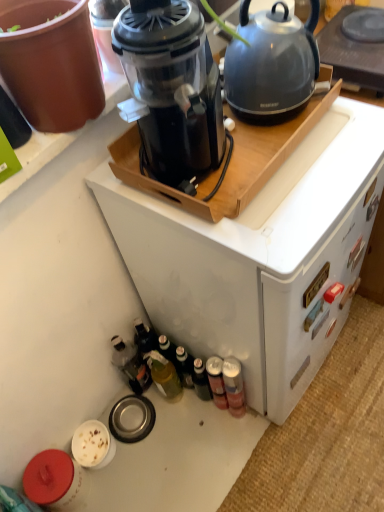
Question: Is metallic silver can at lower right, which is the 4th bottle from left to right, bigger than black plastic blender at upper center?

Choices:
 (A) no
 (B) yes

Answer: (A)

Question: Considering the relative sizes of metallic silver can at lower right, which is the 4th bottle from left to right, and black plastic blender at upper center in the image provided, is metallic silver can at lower right, which is the 4th bottle from left to right, thinner than black plastic blender at upper center?

Choices:
 (A) no
 (B) yes

Answer: (B)

Question: Is metallic silver can at lower right, the first bottle positioned from the right, outside black plastic blender at upper center?

Choices:
 (A) no
 (B) yes

Answer: (B)

Question: Can you confirm if metallic silver can at lower right, which is the 4th bottle from left to right, is taller than black plastic blender at upper center?

Choices:
 (A) no
 (B) yes

Answer: (A)

Question: Can you confirm if metallic silver can at lower right, the first bottle positioned from the right, is smaller than black plastic blender at upper center?

Choices:
 (A) no
 (B) yes

Answer: (B)

Question: Is the depth of metallic silver can at lower right, which is the 4th bottle from left to right, greater than that of black plastic blender at upper center?

Choices:
 (A) no
 (B) yes

Answer: (B)

Question: Is metallic silver can at lower right, which is the third bottle from left to right, bigger than metallic silver can at lower right, the first bottle positioned from the right?

Choices:
 (A) no
 (B) yes

Answer: (A)

Question: Is metallic silver can at lower right, which is the third bottle from left to right, to the right of metallic silver can at lower right, the first bottle positioned from the right, from the viewer's perspective?

Choices:
 (A) no
 (B) yes

Answer: (A)

Question: Does metallic silver can at lower right, which is the third bottle from left to right, have a greater width compared to metallic silver can at lower right, which is the 4th bottle from left to right?

Choices:
 (A) no
 (B) yes

Answer: (A)

Question: From a real-world perspective, is metallic silver can at lower right, which is the third bottle from left to right, below metallic silver can at lower right, which is the 4th bottle from left to right?

Choices:
 (A) no
 (B) yes

Answer: (B)

Question: Is metallic silver can at lower right, marked as the 2th bottle in a right-to-left arrangement, to the left of metallic silver can at lower right, which is the 4th bottle from left to right, from the viewer's perspective?

Choices:
 (A) no
 (B) yes

Answer: (B)

Question: Is metallic silver can at lower right, which is the third bottle from left to right, aimed at metallic silver can at lower right, the first bottle positioned from the right?

Choices:
 (A) yes
 (B) no

Answer: (A)

Question: Considering the relative positions of black plastic blender at upper center and metallic silver can at lower right, the first bottle positioned from the right, in the image provided, is black plastic blender at upper center behind metallic silver can at lower right, the first bottle positioned from the right,?

Choices:
 (A) no
 (B) yes

Answer: (A)